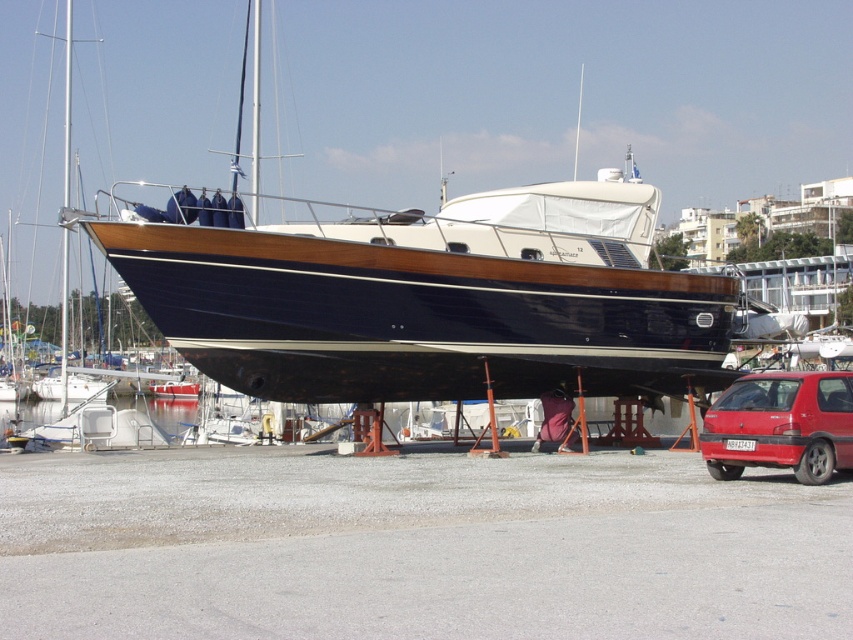
Who is taller, shiny dark wood boat at center or matte red hatchback at lower right?

shiny dark wood boat at center

Between shiny dark wood boat at center and matte red hatchback at lower right, which one appears on the right side from the viewer's perspective?

Positioned to the right is matte red hatchback at lower right.

Locate an element on the screen. shiny dark wood boat at center is located at coordinates click(x=434, y=300).